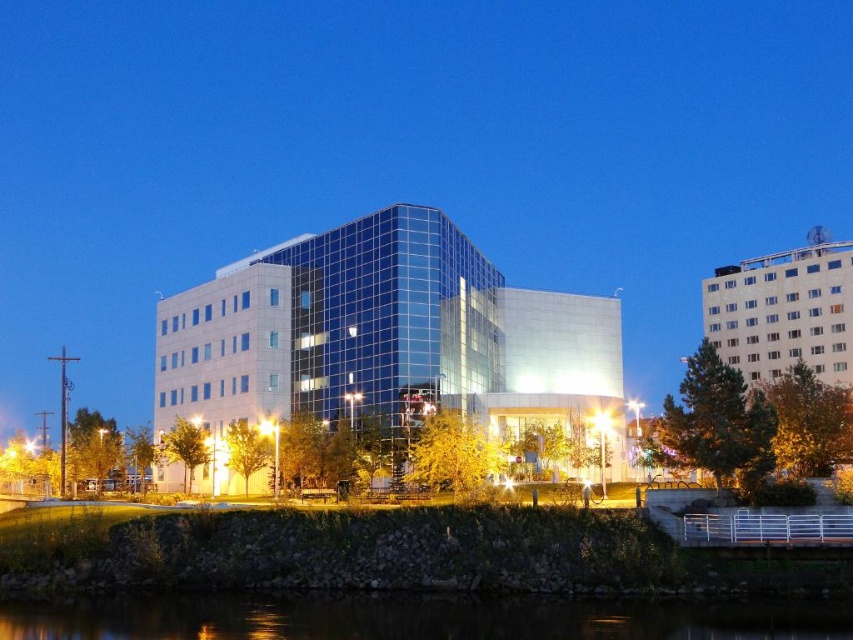
You are an architect evaluating the urban skyline. Which building, the glassy blue building at center or the white textured building at upper right, is shorter?

The glassy blue building at center is shorter than the white textured building at upper right.

You are standing in the urban scene and want to move from the point closer to you to the point further away. Which path would you take between the two points, point (695, 618) and point (830, 348)?

You should take the path leading towards point (830, 348) because it is further away from you compared to point (695, 618) which is closer.

You are standing on the sidewalk and want to take a photo of the glassy blue building at center. If your camera can focus on objects up to 200 feet away, will you need to move closer to capture a clear image?

The glassy blue building at center is 217.59 feet away from the viewer. Since the camera can only focus up to 200 feet, you need to move closer to ensure the building is within the camera range.